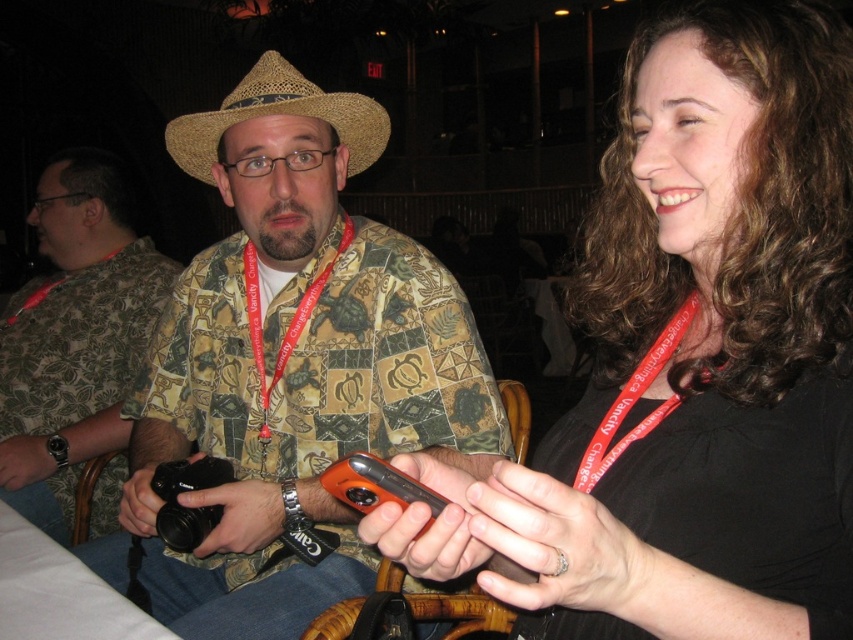
Question: Can you confirm if matte black camera at center is positioned below strawhat at center?

Choices:
 (A) yes
 (B) no

Answer: (A)

Question: Based on their relative distances, which object is nearer to the matte black phone at center?

Choices:
 (A) matte black camera at center
 (B) strawhat at center
 (C) brushed metal camera at left

Answer: (A)

Question: Among these points, which one is nearest to the camera?

Choices:
 (A) (338, 102)
 (B) (114, 204)

Answer: (A)

Question: Which point is closer to the camera?

Choices:
 (A) matte black phone at center
 (B) strawhat at center
 (C) brushed metal camera at left
 (D) matte black camera at center

Answer: (A)

Question: Does matte black phone at center appear over strawhat at center?

Choices:
 (A) yes
 (B) no

Answer: (B)

Question: Is matte black phone at center bigger than matte black camera at center?

Choices:
 (A) yes
 (B) no

Answer: (B)